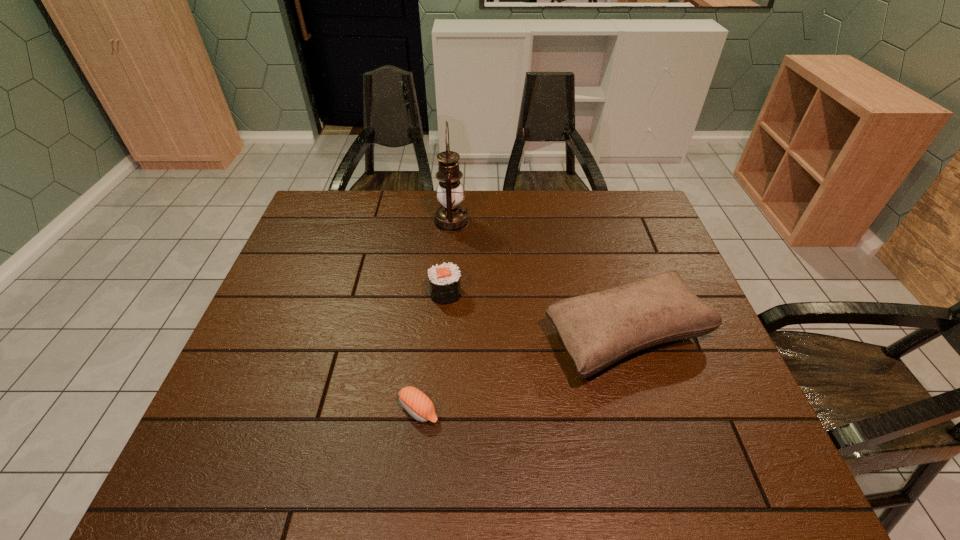
In order to click on the tallest object in this screenshot , I will do `click(451, 217)`.

Find the location of a particular element. oil lamp is located at coordinates (451, 217).

I want to click on cushion, so click(598, 329).

You are a GUI agent. You are given a task and a screenshot of the screen. Output one action in this format:
    pyautogui.click(x=<x>, y=<y>)
    Task: Click on the third shortest object
    
    Given the screenshot: What is the action you would take?
    pyautogui.click(x=598, y=329)

This screenshot has width=960, height=540. What are the coordinates of `the third tallest object` in the screenshot? It's located at (444, 280).

Identify the location of the taller sushi. This screenshot has width=960, height=540. (444, 280).

You are a GUI agent. You are given a task and a screenshot of the screen. Output one action in this format:
    pyautogui.click(x=<x>, y=<y>)
    Task: Click on the nearer sushi
    This screenshot has width=960, height=540.
    Given the screenshot: What is the action you would take?
    pyautogui.click(x=415, y=402)

Find the location of a particular element. This screenshot has height=540, width=960. the shortest object is located at coordinates (415, 402).

In order to click on free space located 0.290m on the front of the tallest object in this screenshot , I will do `click(445, 303)`.

You are a GUI agent. You are given a task and a screenshot of the screen. Output one action in this format:
    pyautogui.click(x=<x>, y=<y>)
    Task: Click on the vacant space situated 0.260m on the back of the rightmost object
    This screenshot has width=960, height=540.
    Given the screenshot: What is the action you would take?
    pyautogui.click(x=595, y=232)